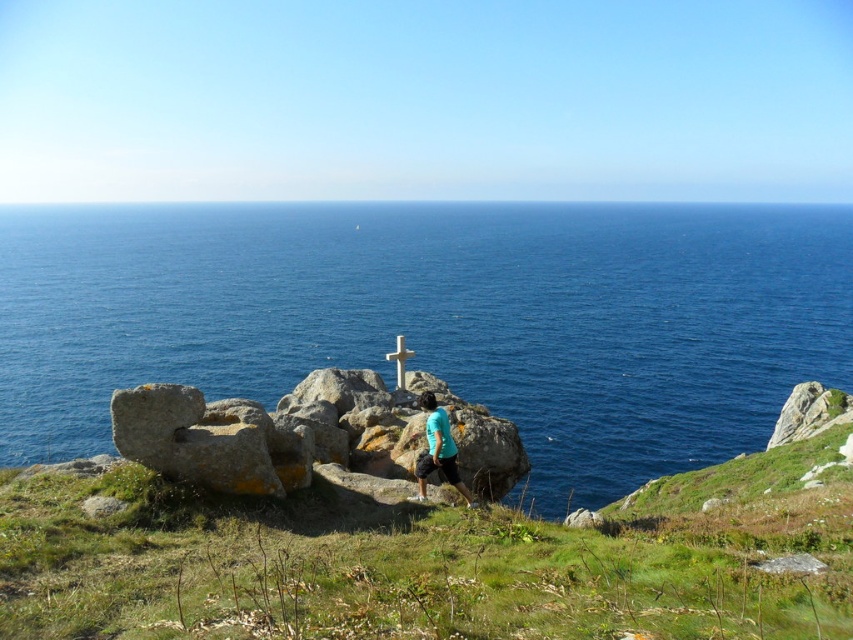
Question: Can you confirm if blue water at center is positioned below rusty stone bench at center?

Choices:
 (A) no
 (B) yes

Answer: (A)

Question: Estimate the real-world distances between objects in this image. Which object is closer to the green grassy at center?

Choices:
 (A) white stone cross at center
 (B) blue matte shirt at center
 (C) rusty stone bench at center

Answer: (B)

Question: Which object is farther from the camera taking this photo?

Choices:
 (A) green grassy at center
 (B) blue matte shirt at center

Answer: (B)

Question: Considering the real-world distances, which object is farthest from the rusty stone bench at center?

Choices:
 (A) green grassy at center
 (B) blue matte shirt at center
 (C) white stone cross at center

Answer: (B)

Question: Can you confirm if green grassy at center is wider than white stone cross at center?

Choices:
 (A) no
 (B) yes

Answer: (B)

Question: Can you confirm if green grassy at center is wider than blue matte shirt at center?

Choices:
 (A) no
 (B) yes

Answer: (B)